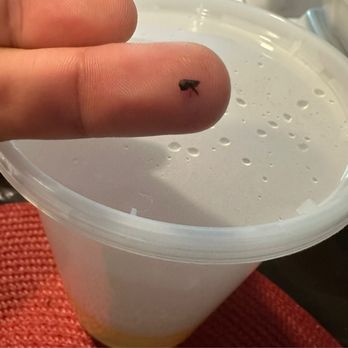
The image size is (348, 348). Identify the location of red table mat. [x=34, y=319].